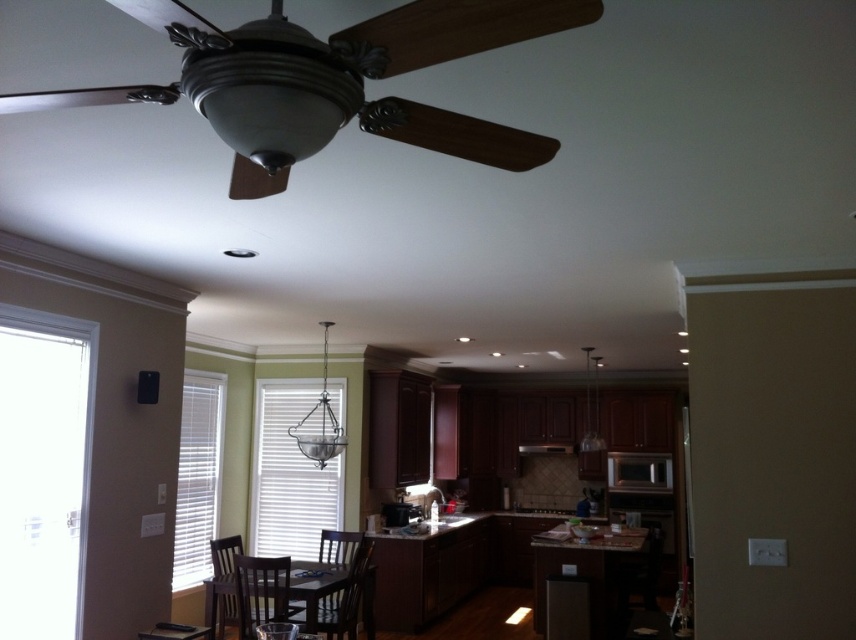
From the picture: Which is below, metallic brown ceiling fan at upper center or dark brown wooden chair at lower left?

dark brown wooden chair at lower left is lower down.

Is metallic brown ceiling fan at upper center smaller than dark brown wooden chair at lower left?

Indeed, metallic brown ceiling fan at upper center has a smaller size compared to dark brown wooden chair at lower left.

Does point (544, 154) come in front of point (217, 628)?

Yes, point (544, 154) is in front of point (217, 628).

Where is `metallic brown ceiling fan at upper center`? metallic brown ceiling fan at upper center is located at coordinates (461, 28).

Can you confirm if dark brown wooden chair at lower left is positioned to the left of black glossy microwave at center?

Correct, you'll find dark brown wooden chair at lower left to the left of black glossy microwave at center.

Which is in front, point (235, 586) or point (393, 518)?

Point (235, 586) is more forward.

Is point (236, 618) farther from viewer compared to point (391, 513)?

No, (236, 618) is in front of (391, 513).

What are the coordinates of `dark brown wooden chair at lower left` in the screenshot? It's located at (223, 582).

Between point (241, 552) and point (633, 474), which one is positioned behind?

Positioned behind is point (633, 474).

At what (x,y) coordinates should I click in order to perform the action: click on dark brown wooden chair at lower left. Please return your answer as a coordinate pair (x, y). The height and width of the screenshot is (640, 856). Looking at the image, I should click on click(223, 582).